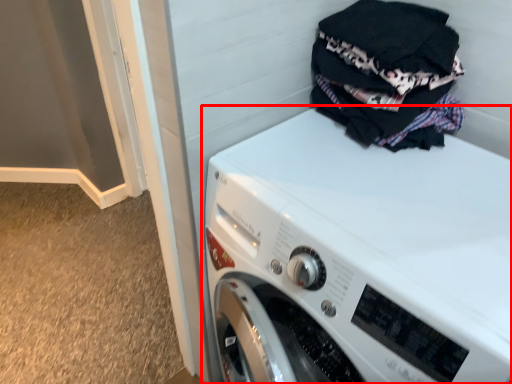
Question: Considering the relative positions of washing machine (annotated by the red box) and laundry in the image provided, where is washing machine (annotated by the red box) located with respect to the staircase?

Choices:
 (A) right
 (B) left

Answer: (B)